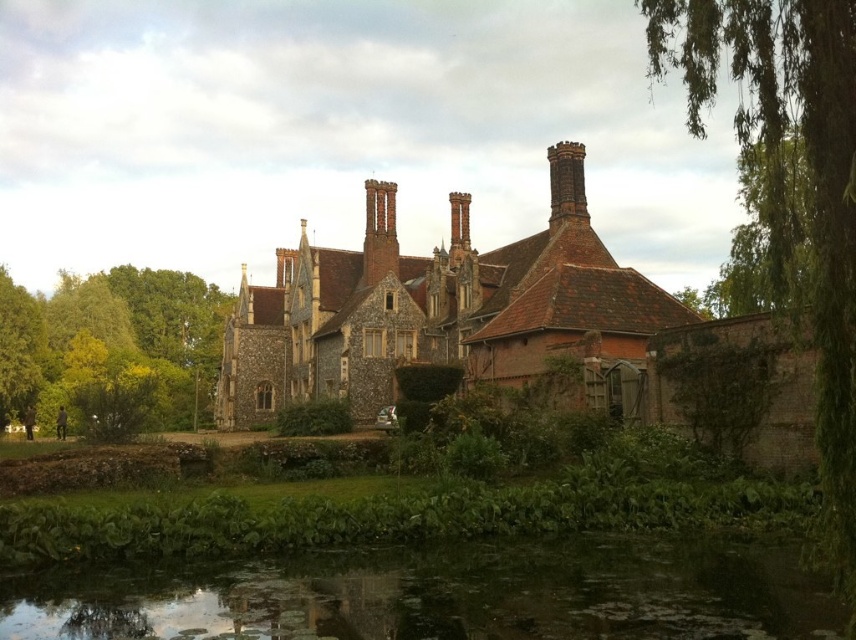
Is the position of smooth brick chimney at center less distant than that of dark brown brick chimney at upper center?

That is False.

Can you confirm if smooth brick chimney at center is taller than dark brown brick chimney at upper center?

Yes.

Identify the location of smooth brick chimney at center. (379, 230).

Which is behind, point (816, 77) or point (390, 237)?

The point (390, 237) is more distant.

Locate an element on the screen. This screenshot has height=640, width=856. green leafy tree at right is located at coordinates (801, 176).

Locate an element on the screen. green leafy tree at right is located at coordinates (801, 176).

Can you confirm if green leafy tree at right is positioned to the left of green leafy tree at lower left?

Incorrect, green leafy tree at right is not on the left side of green leafy tree at lower left.

Is green leafy tree at right above green leafy tree at lower left?

Correct, green leafy tree at right is located above green leafy tree at lower left.

Between point (847, 401) and point (3, 337), which one is positioned behind?

The point (3, 337) is more distant.

At what (x,y) coordinates should I click in order to perform the action: click on green leafy tree at right. Please return your answer as a coordinate pair (x, y). This screenshot has width=856, height=640. Looking at the image, I should click on (801, 176).